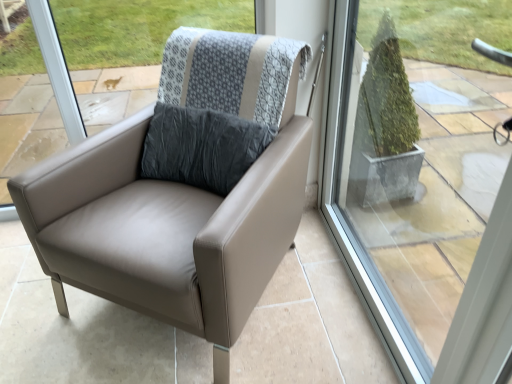
The width and height of the screenshot is (512, 384). What do you see at coordinates (424, 182) in the screenshot? I see `transparent glass window at center` at bounding box center [424, 182].

Locate an element on the screen. Image resolution: width=512 pixels, height=384 pixels. transparent glass window at center is located at coordinates (424, 182).

The width and height of the screenshot is (512, 384). What do you see at coordinates (179, 198) in the screenshot?
I see `matte leather chair at center` at bounding box center [179, 198].

At what (x,y) coordinates should I click in order to perform the action: click on matte leather chair at center. Please return your answer as a coordinate pair (x, y). The height and width of the screenshot is (384, 512). Looking at the image, I should click on (179, 198).

You are a GUI agent. You are given a task and a screenshot of the screen. Output one action in this format:
    pyautogui.click(x=<x>, y=<y>)
    Task: Click on the transparent glass window at center
    This screenshot has width=512, height=384.
    Given the screenshot: What is the action you would take?
    pyautogui.click(x=424, y=182)

Which object is positioned more to the left, transparent glass window at center or matte leather chair at center?

matte leather chair at center is more to the left.

Does transparent glass window at center come in front of matte leather chair at center?

Yes, it is.

Which is in front, point (364, 123) or point (228, 234)?

Positioned in front is point (228, 234).

From the image's perspective, does transparent glass window at center appear higher than matte leather chair at center?

No, from the image's perspective, transparent glass window at center is not on top of matte leather chair at center.

From a real-world perspective, is transparent glass window at center physically below matte leather chair at center?

No, from a real-world perspective, transparent glass window at center is not below matte leather chair at center.

Is transparent glass window at center wider than matte leather chair at center?

No, transparent glass window at center is not wider than matte leather chair at center.

Considering the relative sizes of transparent glass window at center and matte leather chair at center in the image provided, is transparent glass window at center shorter than matte leather chair at center?

No, transparent glass window at center is not shorter than matte leather chair at center.

Can you confirm if transparent glass window at center is bigger than matte leather chair at center?

No, transparent glass window at center is not bigger than matte leather chair at center.

Is transparent glass window at center surrounding matte leather chair at center?

No, matte leather chair at center is not surrounded by transparent glass window at center.

Is transparent glass window at center directly adjacent to matte leather chair at center?

No.

Is transparent glass window at center facing towards matte leather chair at center?

Yes, transparent glass window at center is turned towards matte leather chair at center.

Locate an element on the screen. This screenshot has height=384, width=512. chair that is behind the transparent glass window at center is located at coordinates coord(179,198).

Considering the relative positions of matte leather chair at center and transparent glass window at center in the image provided, is matte leather chair at center to the left of transparent glass window at center from the viewer's perspective?

Indeed, matte leather chair at center is positioned on the left side of transparent glass window at center.

Is matte leather chair at center positioned behind transparent glass window at center?

Yes, matte leather chair at center is behind transparent glass window at center.

Is point (226, 53) behind point (497, 353)?

Yes, point (226, 53) is farther from viewer.

From the image's perspective, is matte leather chair at center on transparent glass window at center?

Yes, from the image's perspective, matte leather chair at center is over transparent glass window at center.

From a real-world perspective, is matte leather chair at center over transparent glass window at center?

No.

Which of these two, matte leather chair at center or transparent glass window at center, is wider?

matte leather chair at center is wider.

Which of these two, matte leather chair at center or transparent glass window at center, stands taller?

transparent glass window at center.

From the picture: Can you confirm if matte leather chair at center is smaller than transparent glass window at center?

No, matte leather chair at center is not smaller than transparent glass window at center.

From the picture: Is matte leather chair at center located outside transparent glass window at center?

That's correct, matte leather chair at center is outside of transparent glass window at center.

Is the surface of matte leather chair at center in direct contact with transparent glass window at center?

There is a gap between matte leather chair at center and transparent glass window at center.

Is matte leather chair at center looking in the opposite direction of transparent glass window at center?

No, matte leather chair at center is not facing away from transparent glass window at center.

Can you tell me how much matte leather chair at center and transparent glass window at center differ in facing direction?

matte leather chair at center and transparent glass window at center are facing 52.4 degrees away from each other.

The width and height of the screenshot is (512, 384). In order to click on window to the right of matte leather chair at center in this screenshot , I will do `click(424, 182)`.

Where is `chair above the transparent glass window at center (from the image's perspective)`? This screenshot has height=384, width=512. chair above the transparent glass window at center (from the image's perspective) is located at coordinates (179, 198).

What are the coordinates of `chair behind the transparent glass window at center` in the screenshot? It's located at (179, 198).